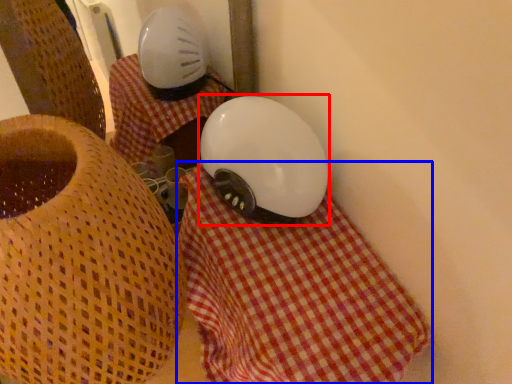
Question: Which of the following is the farthest to the observer, helmet (highlighted by a red box) or blanket (highlighted by a blue box)?

Choices:
 (A) helmet
 (B) blanket

Answer: (A)